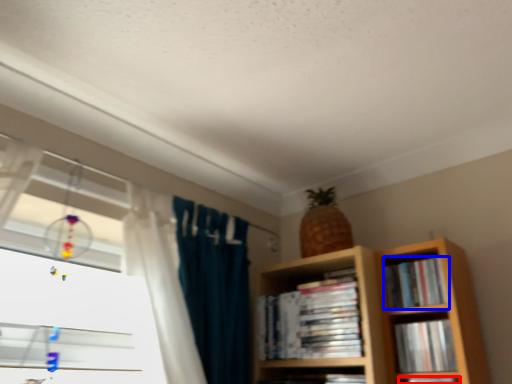
Question: Which of the following is the closest to the observer, book (highlighted by a red box) or book (highlighted by a blue box)?

Choices:
 (A) book
 (B) book

Answer: (A)